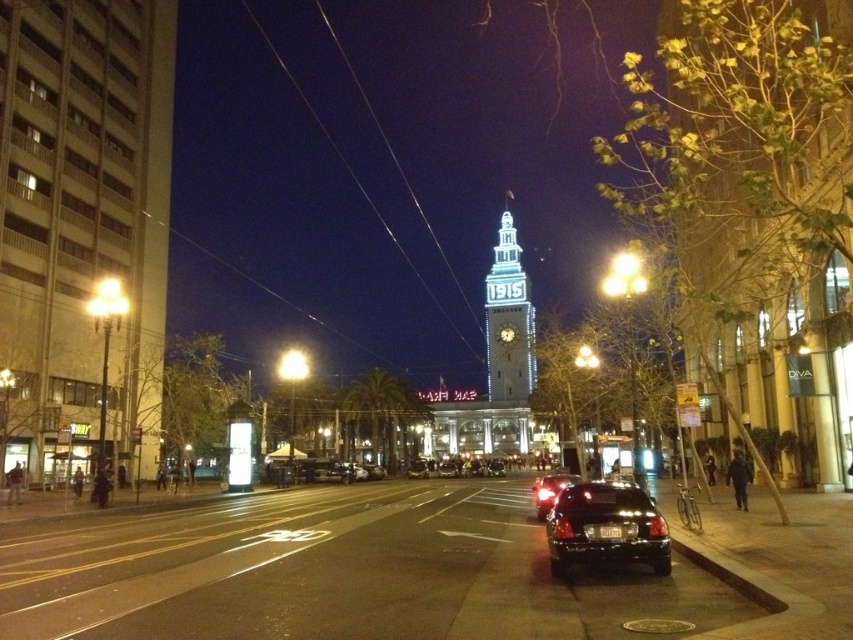
Question: In this image, where is satin black sedan at center located relative to black glossy car at center?

Choices:
 (A) above
 (B) below

Answer: (B)

Question: Which point is farther to the camera?

Choices:
 (A) shiny black sedan at center
 (B) black glossy car at center
 (C) illuminated glass clock tower at center
 (D) satin black sedan at center

Answer: (A)

Question: Among these objects, which one is nearest to the camera?

Choices:
 (A) satin black sedan at center
 (B) black glossy car at center
 (C) illuminated glass clock tower at center

Answer: (A)

Question: Which point is farther from the camera taking this photo?

Choices:
 (A) (320, 461)
 (B) (498, 353)
 (C) (552, 486)
 (D) (621, 522)

Answer: (A)

Question: In this image, where is satin black sedan at center located relative to shiny black sedan at center?

Choices:
 (A) left
 (B) right

Answer: (B)

Question: Is illuminated glass clock tower at center in front of black glossy car at center?

Choices:
 (A) no
 (B) yes

Answer: (A)